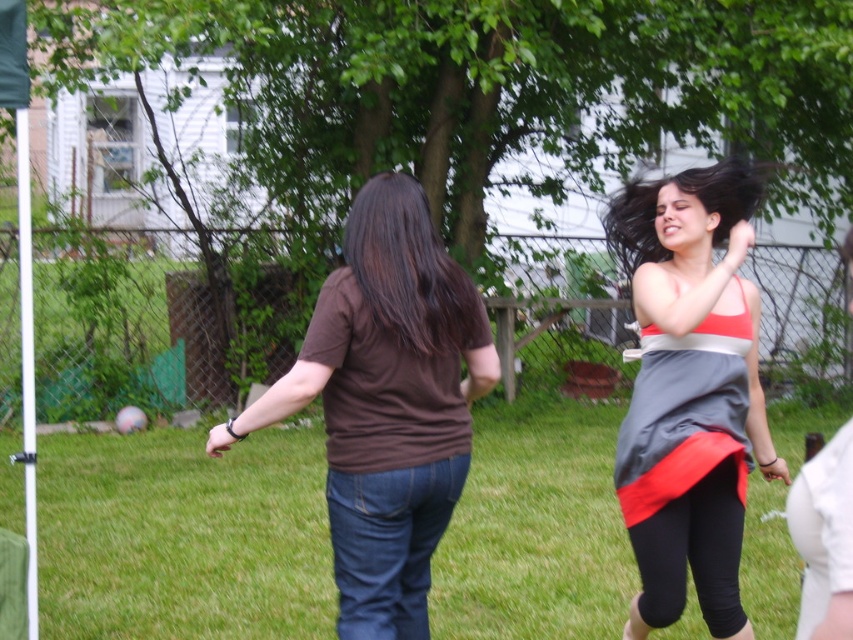
You are standing at the point marked as point (183,536) in the image. What do you see directly in front of you?

You see green grass at center directly in front of you at point (183,536).